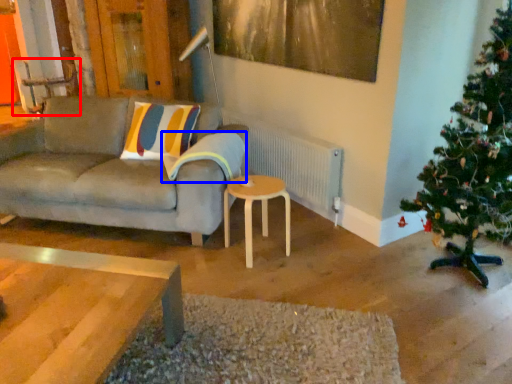
Question: Which object appears closest to the camera in this image, armchair (highlighted by a red box) or pillow (highlighted by a blue box)?

Choices:
 (A) armchair
 (B) pillow

Answer: (B)